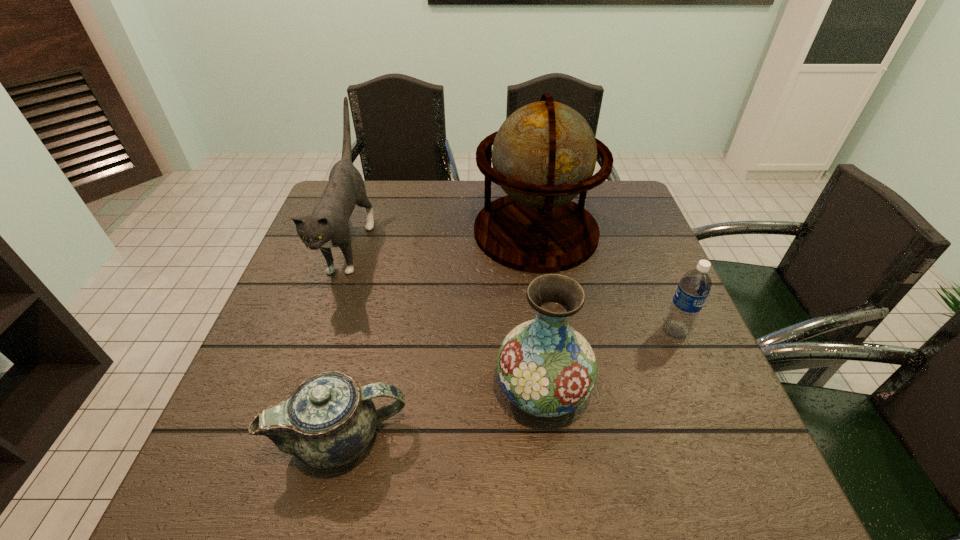
The image size is (960, 540). I want to click on free point between the cat and the tallest object, so click(443, 238).

Where is `vacant area that lies between the vase and the second shortest object`? The width and height of the screenshot is (960, 540). vacant area that lies between the vase and the second shortest object is located at coordinates (609, 360).

The image size is (960, 540). I want to click on free space between the water bottle and the globe, so click(606, 281).

Identify the location of the second closest object to the rightmost object. Image resolution: width=960 pixels, height=540 pixels. coord(546,368).

Find the location of a particular element. the fourth closest object relative to the cat is located at coordinates (694, 287).

Locate an element on the screen. vacant space that satisfies the following two spatial constraints: 1. at the face of the vase; 2. on the right side of the second tallest object is located at coordinates (300, 388).

The width and height of the screenshot is (960, 540). In order to click on vacant space that satisfies the following two spatial constraints: 1. on the front-facing side of the third nearest object; 2. on the right side of the globe in this screenshot , I will do `click(551, 330)`.

Locate an element on the screen. vacant space that satisfies the following two spatial constraints: 1. on the front-facing side of the globe; 2. from the spout of the shortest object is located at coordinates 566,437.

You are a GUI agent. You are given a task and a screenshot of the screen. Output one action in this format:
    pyautogui.click(x=<x>, y=<y>)
    Task: Click on the vacant space that satisfies the following two spatial constraints: 1. on the front-facing side of the tallest object; 2. on the right side of the fourth tallest object
    Image resolution: width=960 pixels, height=540 pixels.
    Given the screenshot: What is the action you would take?
    [551, 330]

The image size is (960, 540). I want to click on vacant space that satisfies the following two spatial constraints: 1. on the back side of the vase; 2. on the right side of the second shortest object, so click(536, 330).